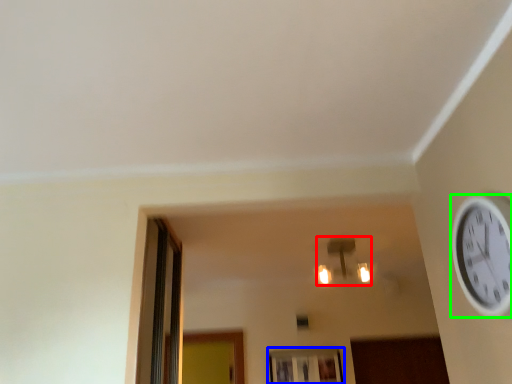
Question: Which is nearer to the light fixture (highlighted by a red box)? window (highlighted by a blue box) or wall clock (highlighted by a green box).

Choices:
 (A) window
 (B) wall clock

Answer: (A)